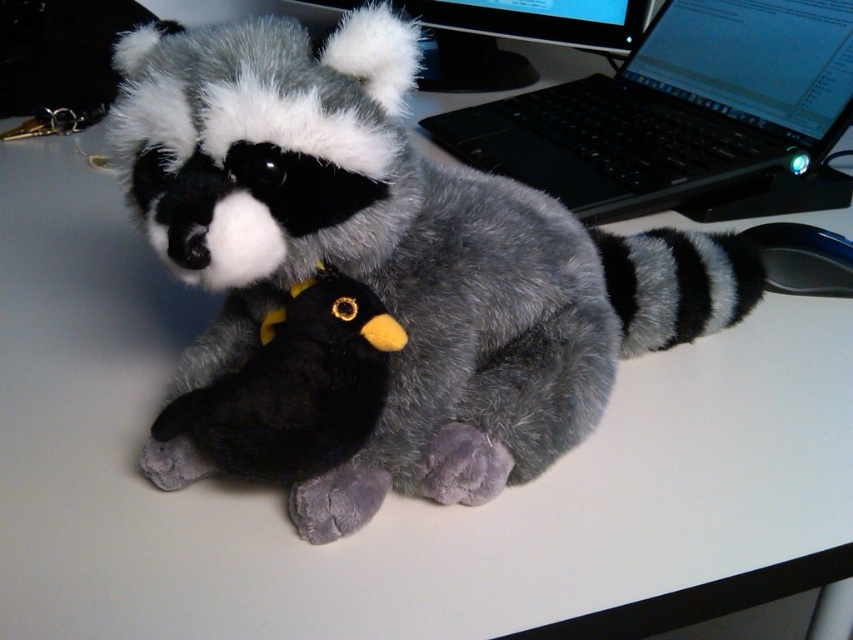
You are organizing cables for the black plastic laptop at upper right and the black glossy monitor at upper center. Which device should you plug into first if you want to start with the one closer to you?

You should plug in the black plastic laptop at upper right first because it is closer to the viewer than the black glossy monitor at upper center.

You are organizing the desk and need to move the black plastic laptop at upper right to the right side of the fluffy gray raccoon at center. Is this possible without moving the raccoon?

The fluffy gray raccoon at center is already to the left of the black plastic laptop at upper right, so moving the laptop to the right of the raccoon would require placing it further right than its current position. Since the laptop is already positioned to the right of the raccoon, moving it further right may not be feasible without additional space. However, the question specifies moving it to the right side of the raccoon, which is its current position. Therefore, no action is needed as the laptop is alr

You are organizing a desk and need to determine if the fluffy gray raccoon at center can be placed on top of the black plastic laptop at upper right without exceeding the laptop screen height. Can it fit?

The fluffy gray raccoon at center has a lesser height compared to the black plastic laptop at upper right, so it can be placed on top without exceeding the laptop screen height.